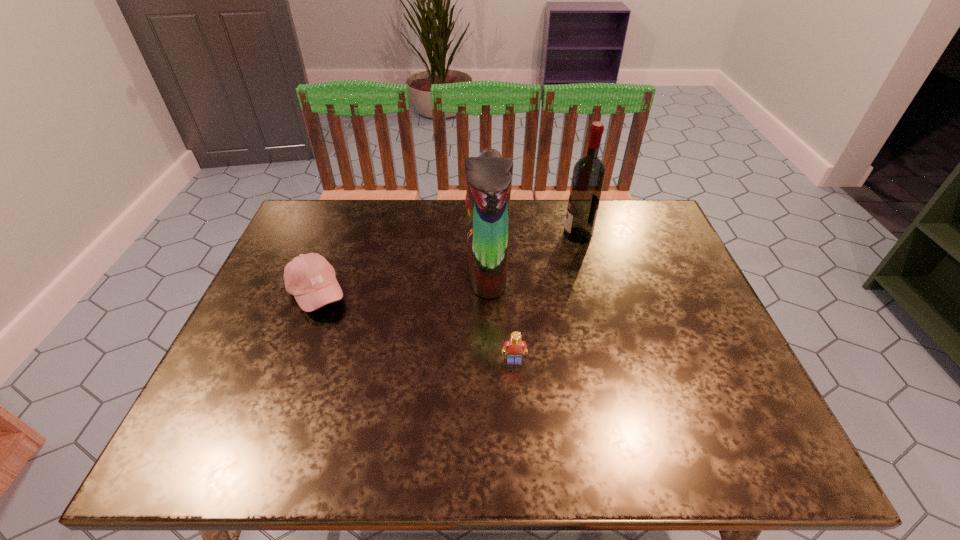
Identify the location of alcohol. This screenshot has height=540, width=960. (588, 176).

Image resolution: width=960 pixels, height=540 pixels. Identify the location of parrot. (489, 176).

At what (x,y) coordinates should I click in order to perform the action: click on the leftmost object. Please return your answer as a coordinate pair (x, y). The width and height of the screenshot is (960, 540). Looking at the image, I should click on (310, 278).

Identify the location of Lego. This screenshot has width=960, height=540. (514, 348).

Image resolution: width=960 pixels, height=540 pixels. In order to click on free space located 0.310m on the front and back of the rightmost object in this screenshot , I will do `click(460, 235)`.

You are a GUI agent. You are given a task and a screenshot of the screen. Output one action in this format:
    pyautogui.click(x=<x>, y=<y>)
    Task: Click on the free location located 0.350m on the front and back of the rightmost object
    The image size is (960, 540).
    Given the screenshot: What is the action you would take?
    pyautogui.click(x=446, y=235)

Find the location of a particular element. The height and width of the screenshot is (540, 960). vacant region located 0.090m on the front and back of the rightmost object is located at coordinates [533, 235].

The image size is (960, 540). I want to click on vacant point located 0.050m at the face of the parrot, so click(x=448, y=269).

The height and width of the screenshot is (540, 960). What are the coordinates of `vacant area situated at the face of the parrot` in the screenshot? It's located at (335, 269).

Locate an element on the screen. free space located at the face of the parrot is located at coordinates (422, 269).